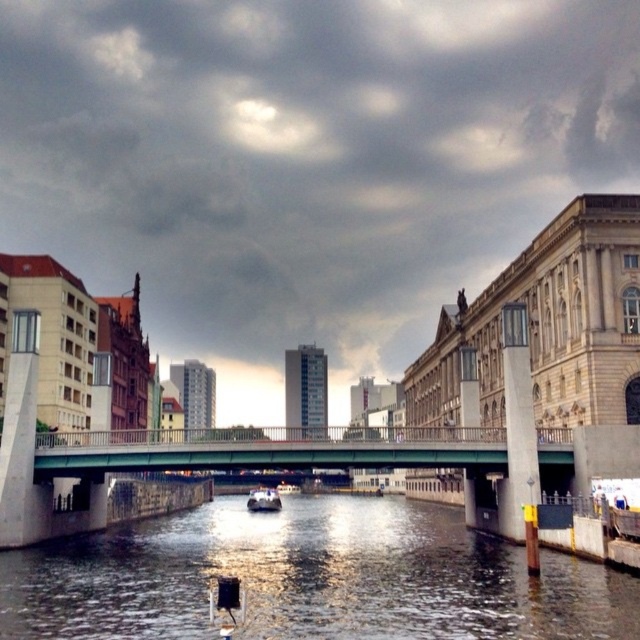
You are a photographer planning to capture the green metallic bridge at center and the white glossy boat at center in a single shot. Based on their positions, will the boat be fully visible behind the bridge or partially obscured?

The green metallic bridge at center is above the white glossy boat at center, so the boat will be partially obscured by the bridge in the photograph.

You are standing at the point closer to the viewer between the two points, point (611,572) and point (260,488). Which point are you standing at?

You are standing at point (611,572) because it is closer to the viewer than point (260,488).